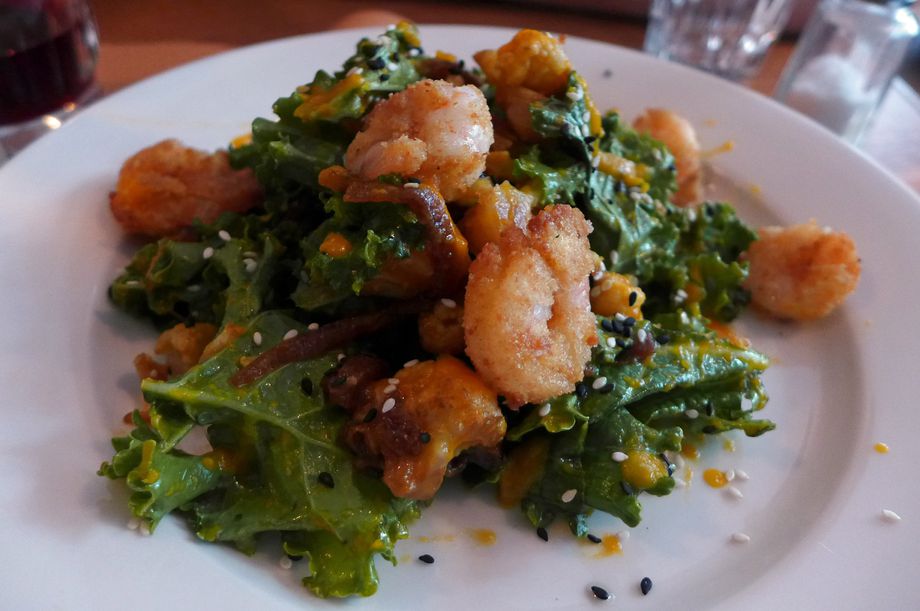
Identify the location of glass with dark liquid inside. (30, 60).